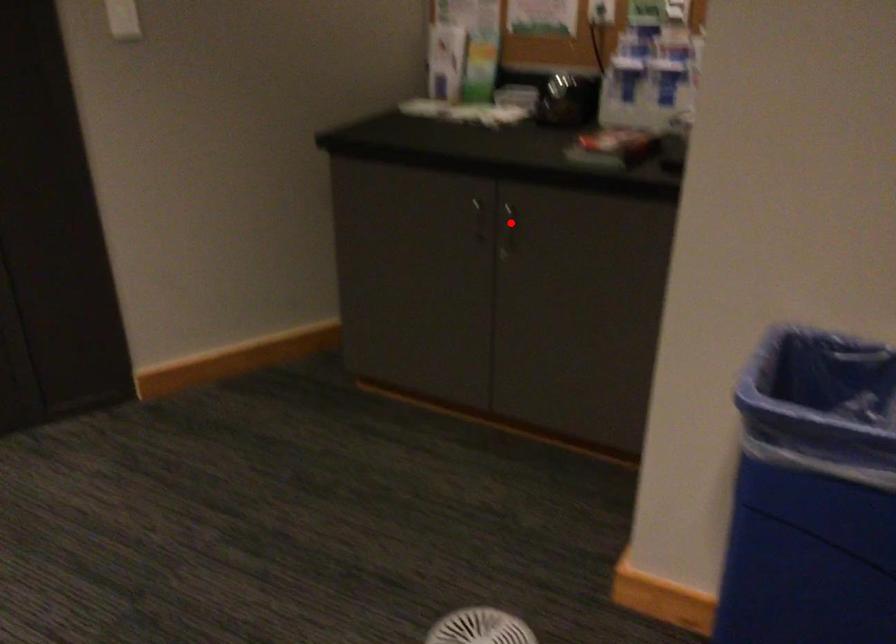
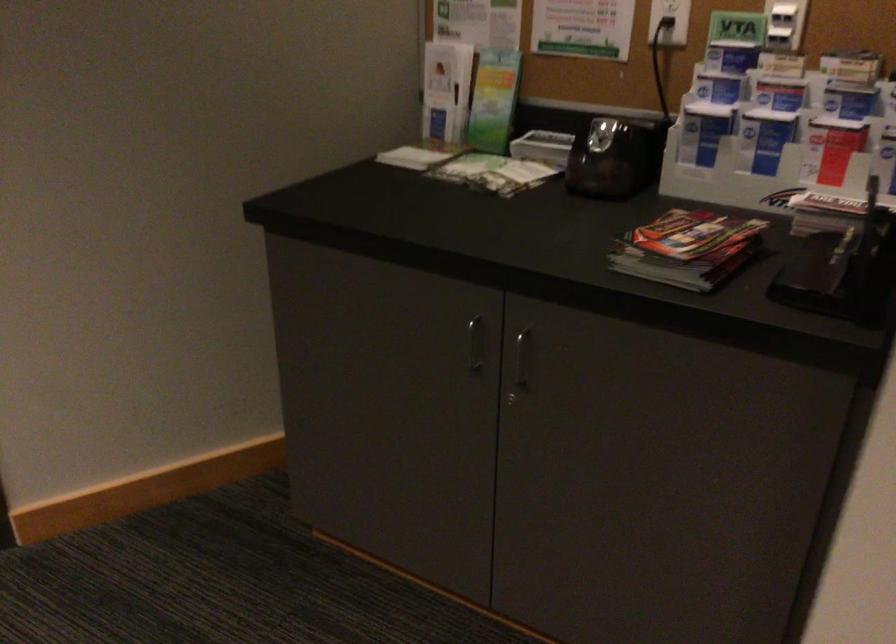
Where in the second image is the point corresponding to the highlighted location from the first image?

(521, 357)